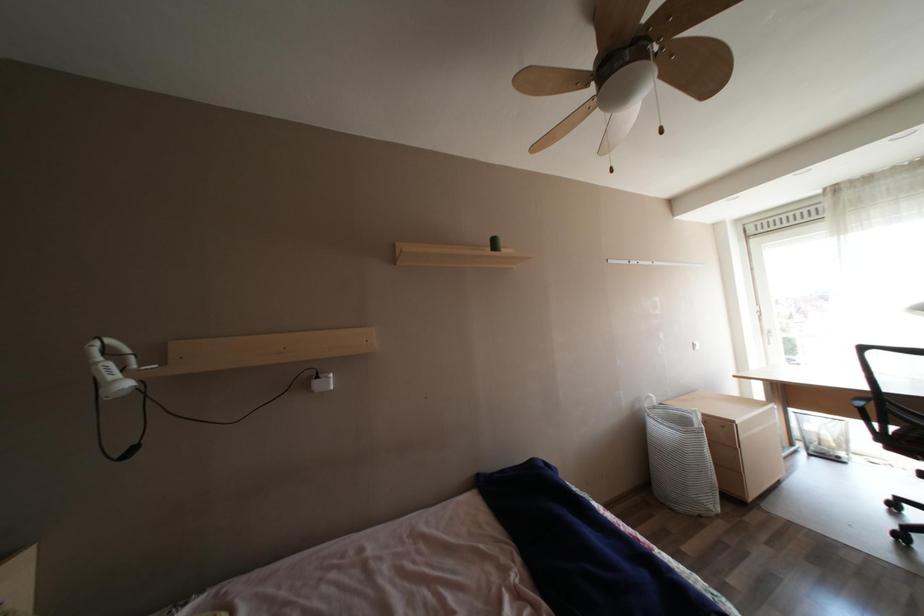
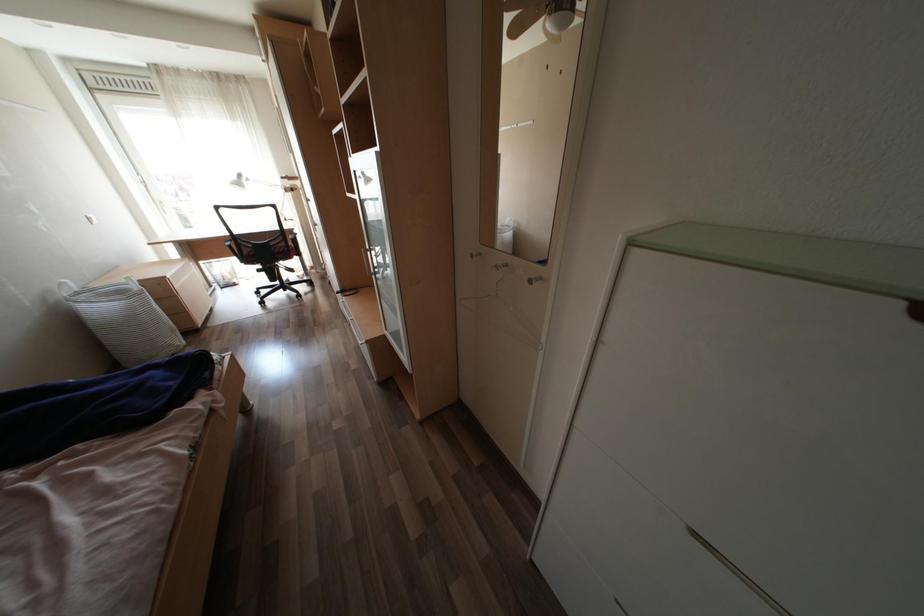
How did the camera likely rotate?

The camera's rotation is toward right-down.